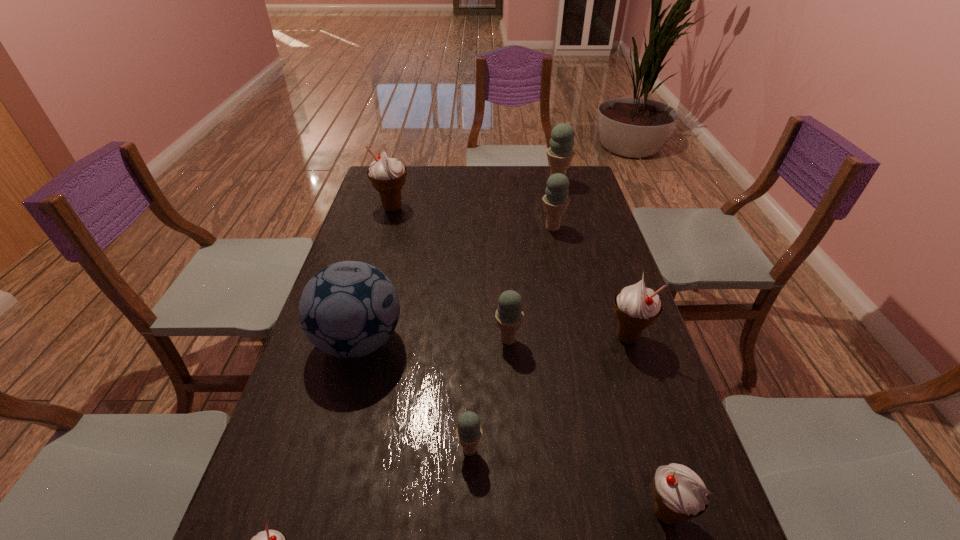
At what (x,y) coordinates should I click in order to perform the action: click on the farthest icecream. Please return your answer as a coordinate pair (x, y). The height and width of the screenshot is (540, 960). Looking at the image, I should click on (560, 153).

This screenshot has height=540, width=960. Find the location of `the farthest object`. the farthest object is located at coordinates (560, 153).

Find the location of `the seventh nearest icecream`. the seventh nearest icecream is located at coordinates click(387, 175).

What are the coordinates of `the eighth nearest object` in the screenshot? It's located at (387, 175).

Where is `blue soccer ball`? blue soccer ball is located at coordinates (349, 309).

Locate an element on the screen. The width and height of the screenshot is (960, 540). the third nearest blue ice cream is located at coordinates (555, 201).

This screenshot has width=960, height=540. I want to click on the third farthest icecream, so click(555, 201).

This screenshot has width=960, height=540. Find the location of `the second farthest white icecream`. the second farthest white icecream is located at coordinates (636, 307).

What are the coordinates of `the seventh farthest icecream` in the screenshot? It's located at (680, 494).

At what (x,y) coordinates should I click in order to perform the action: click on the third farthest white icecream. Please return your answer as a coordinate pair (x, y). Looking at the image, I should click on (680, 494).